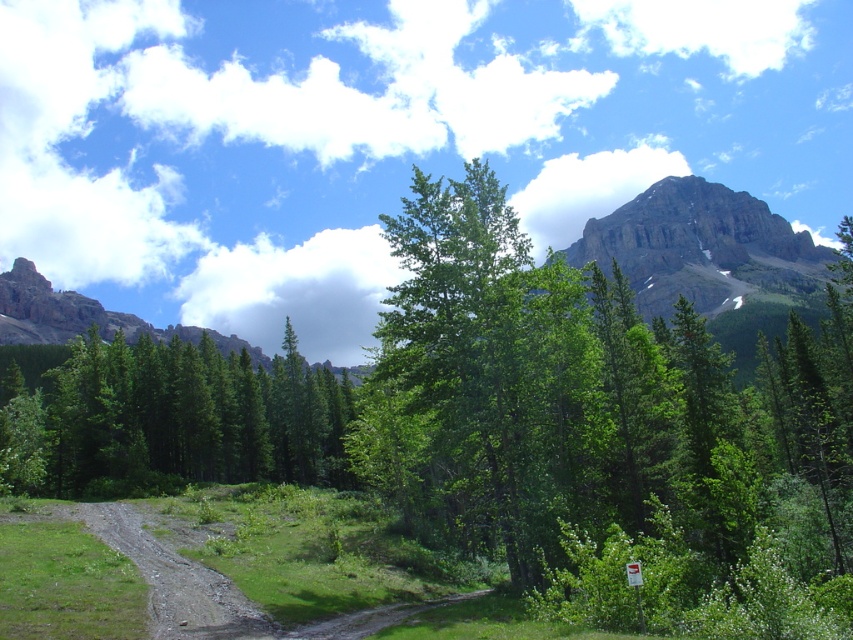
You are planning a hiking route and need to decide whether to prioritize the green leafy tree at center or the rugged stone mountain at upper left based on their visual prominence in the image. Which one should you focus on for better visibility in your map?

The rugged stone mountain at upper left is more visually prominent because it occupies more space than the green leafy tree at center in the image.

You are a hiker trying to navigate through the forest. You see the green matte tree at center and the rugged stone mountain at upper left. Which object is closer to your current position?

The green matte tree at center is closer to your current position because it is positioned under the rugged stone mountain at upper left, indicating it is in front of the mountain.

You are standing at the point marked by the coordinates point (701, 248) in the image. What can you see in the direction of the upper right from this position?

You can see a rocky gray mountain at upper right in the direction of the upper right from point (701, 248).